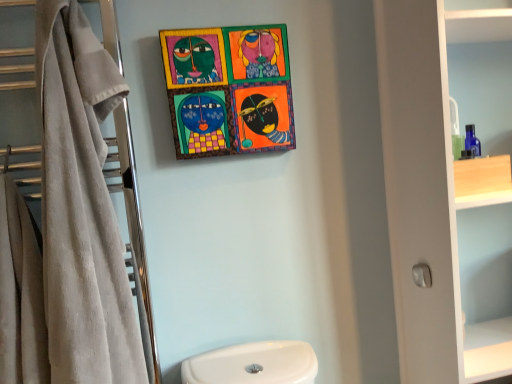
Question: Does beige soft towel at left have a smaller size compared to beige towel at left?

Choices:
 (A) yes
 (B) no

Answer: (A)

Question: Is beige soft towel at left facing away from beige towel at left?

Choices:
 (A) no
 (B) yes

Answer: (A)

Question: Is beige soft towel at left positioned behind beige towel at left?

Choices:
 (A) no
 (B) yes

Answer: (A)

Question: Is beige soft towel at left completely or partially outside of beige towel at left?

Choices:
 (A) yes
 (B) no

Answer: (A)

Question: Is beige soft towel at left far from beige towel at left?

Choices:
 (A) no
 (B) yes

Answer: (A)

Question: Does beige soft towel at left have a lesser width compared to beige towel at left?

Choices:
 (A) yes
 (B) no

Answer: (B)

Question: Does white matte cabinet at right come in front of wooden painted artwork at upper center?

Choices:
 (A) no
 (B) yes

Answer: (B)

Question: Is white matte cabinet at right turned away from wooden painted artwork at upper center?

Choices:
 (A) yes
 (B) no

Answer: (B)

Question: Is white matte cabinet at right bigger than wooden painted artwork at upper center?

Choices:
 (A) yes
 (B) no

Answer: (A)

Question: From a real-world perspective, is white matte cabinet at right physically above wooden painted artwork at upper center?

Choices:
 (A) no
 (B) yes

Answer: (A)

Question: Is white matte cabinet at right in contact with wooden painted artwork at upper center?

Choices:
 (A) yes
 (B) no

Answer: (B)

Question: Is white matte cabinet at right to the right of wooden painted artwork at upper center from the viewer's perspective?

Choices:
 (A) no
 (B) yes

Answer: (B)

Question: Can you confirm if white matte cabinet at right is taller than beige towel at left?

Choices:
 (A) no
 (B) yes

Answer: (B)